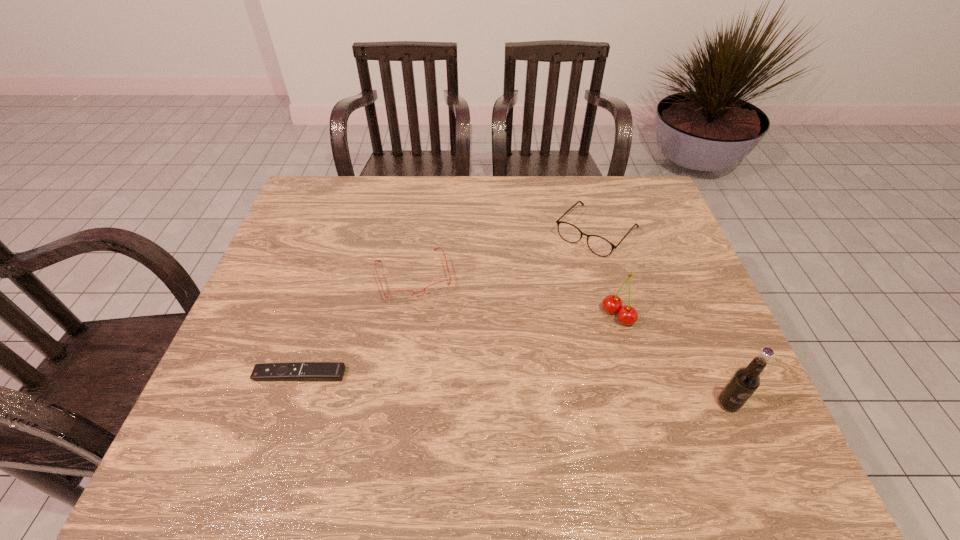
Locate an element on the screen. The image size is (960, 540). free spot between the left spectacles and the second tallest object is located at coordinates (516, 295).

The image size is (960, 540). In order to click on free space that is in between the rightmost object and the second shortest object in this screenshot , I will do `click(571, 339)`.

Locate an element on the screen. vacant area between the shortest object and the shorter spectacles is located at coordinates (356, 325).

Locate which object ranks fourth in proximity to the cherry. Please provide its 2D coordinates. Your answer should be formatted as a tuple, i.e. [(x, y)], where the tuple contains the x and y coordinates of a point satisfying the conditions above.

[(313, 371)]

The height and width of the screenshot is (540, 960). I want to click on object that is the fourth nearest to the shorter spectacles, so click(x=743, y=383).

Image resolution: width=960 pixels, height=540 pixels. I want to click on free space that satisfies the following two spatial constraints: 1. on the back side of the shorter spectacles; 2. on the left side of the taller spectacles, so click(x=420, y=232).

What are the coordinates of `free location that satisfies the following two spatial constraints: 1. on the back side of the right spectacles; 2. on the left side of the fourth shortest object` in the screenshot? It's located at (594, 232).

At what (x,y) coordinates should I click in order to perform the action: click on free space that satisfies the following two spatial constraints: 1. on the back side of the remote control; 2. on the right side of the right spectacles. Please return your answer as a coordinate pair (x, y). Looking at the image, I should click on (346, 232).